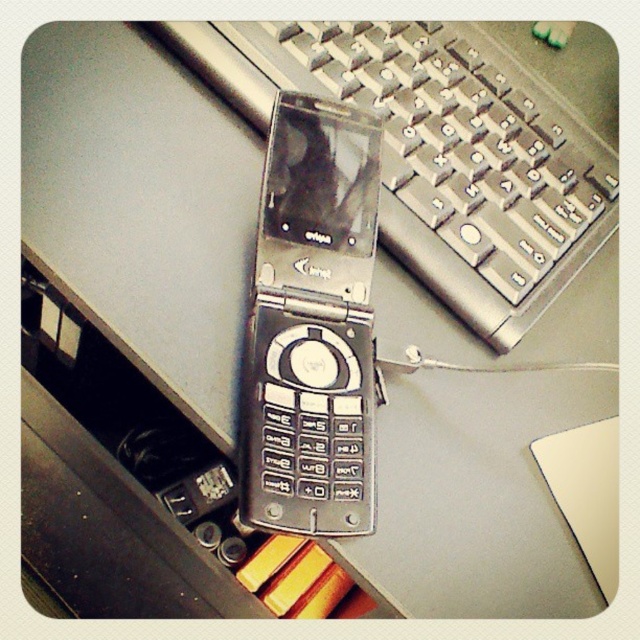
Does silver metallic keyboard at upper center appear on the right side of silver metallic flip phone at center?

Correct, you'll find silver metallic keyboard at upper center to the right of silver metallic flip phone at center.

Is silver metallic keyboard at upper center further to camera compared to silver metallic flip phone at center?

Yes.

At what (x,y) coordinates should I click in order to perform the action: click on silver metallic keyboard at upper center. Please return your answer as a coordinate pair (x, y). Looking at the image, I should click on (442, 152).

What are the coordinates of `silver metallic keyboard at upper center` in the screenshot? It's located at (442, 152).